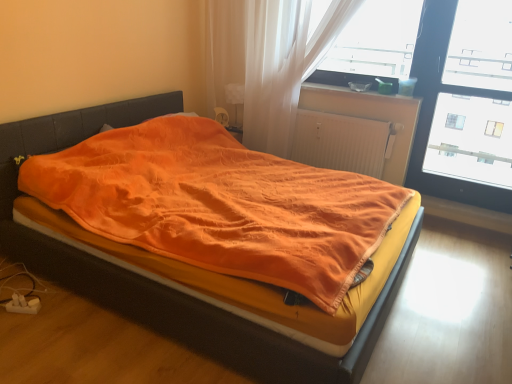
At what (x,y) coordinates should I click in order to perform the action: click on vacant space situated above white ribbed radiator at center (from a real-world perspective). Please return your answer as a coordinate pair (x, y). Image resolution: width=512 pixels, height=384 pixels. Looking at the image, I should click on (341, 111).